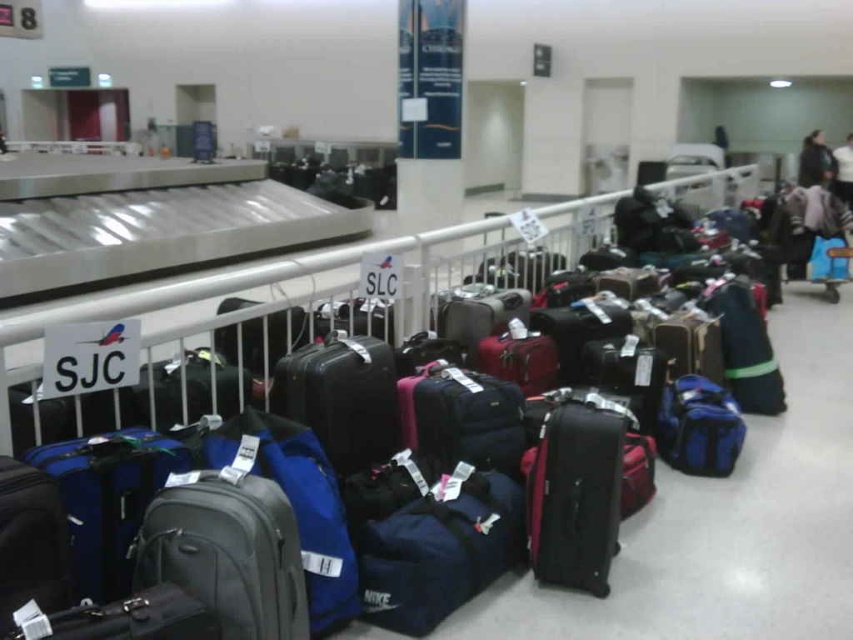
You are a traveler who just arrived at the baggage claim area. You need to find your luggage. You remember that your suitcase is taller than your duffel bag. Which one should you pick between the matte black suitcase at center and the blue fabric duffel at center?

The matte black suitcase at center is much taller as blue fabric duffel at center, so you should pick the matte black suitcase at center because it is taller.

You are a baggage handler who needs to load a new bag onto the metallic silver luggage carousel at center. The new bag is 36 inches long. Can you place it on the carousel without moving the blue fabric duffel at center?

The metallic silver luggage carousel at center is 38.38 inches from blue fabric duffel at center. Since the new bag is 36 inches long, which is shorter than the available space between the carousel and the duffel, you can place it there without moving the blue fabric duffel at center.

In the scene shown: You are at the airport baggage claim area and need to pick up your luggage. You have a matte black suitcase at center and a blue fabric duffel at center. Which one is bigger?

The matte black suitcase at center is larger in size compared to the blue fabric duffel at center.